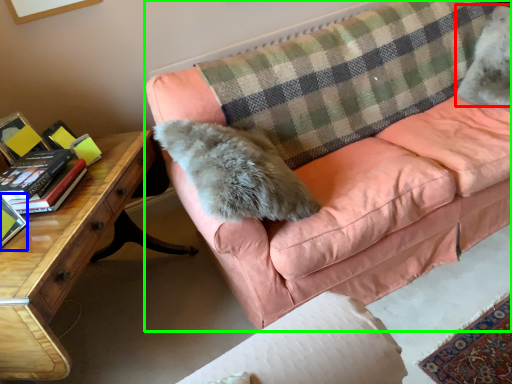
Question: Based on their relative distances, which object is farther from animal (highlighted by a red box)? Choose from paperback book (highlighted by a blue box) and studio couch (highlighted by a green box).

Choices:
 (A) paperback book
 (B) studio couch

Answer: (A)